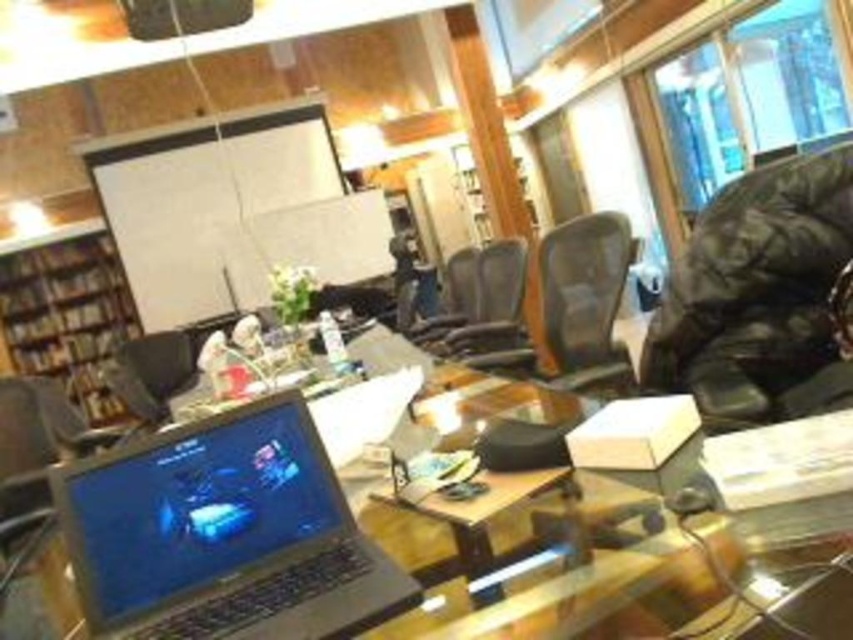
Which is more to the left, matte black chair at center or black leather chair at center?

matte black chair at center is more to the left.

Can you confirm if matte black chair at center is thinner than black leather chair at center?

Incorrect, matte black chair at center's width is not less than black leather chair at center's.

Is point (173, 369) closer to viewer compared to point (432, 321)?

No, (173, 369) is further to viewer.

Where is `matte black chair at center`? The width and height of the screenshot is (853, 640). matte black chair at center is located at coordinates (151, 372).

Which of these two, black mesh office chair at center or matte black chair at center, stands taller?

With more height is black mesh office chair at center.

Is black mesh office chair at center thinner than matte black chair at center?

Yes.

This screenshot has height=640, width=853. I want to click on black mesh office chair at center, so coord(585,300).

Where is `black mesh office chair at center`? The height and width of the screenshot is (640, 853). black mesh office chair at center is located at coordinates (585, 300).

Does leather swivel chair at right have a lesser width compared to black mesh office chair at center?

Indeed, leather swivel chair at right has a lesser width compared to black mesh office chair at center.

Does point (761, 362) come closer to viewer compared to point (518, 355)?

Yes, it is.

This screenshot has width=853, height=640. What do you see at coordinates (758, 298) in the screenshot?
I see `leather swivel chair at right` at bounding box center [758, 298].

This screenshot has width=853, height=640. In order to click on leather swivel chair at right in this screenshot , I will do `click(758, 298)`.